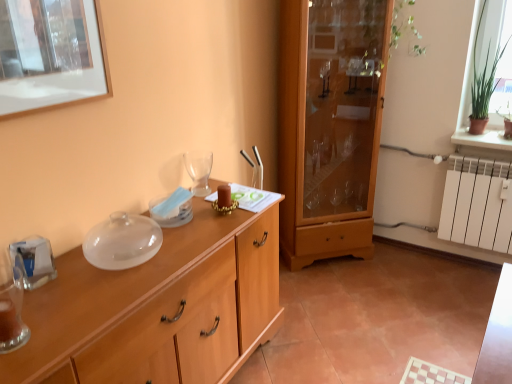
Identify the location of empty space that is ontop of wooden cabinet at center (from a real-world perspective). The width and height of the screenshot is (512, 384). (116, 265).